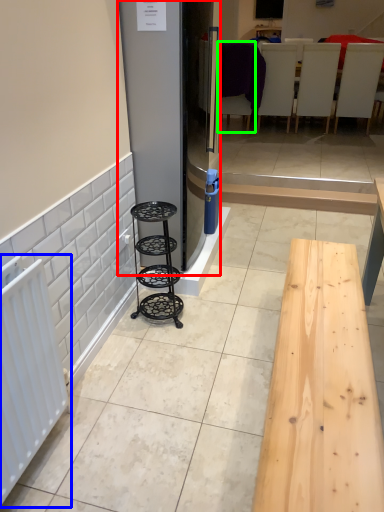
Question: Which object is positioned closest to fridge (highlighted by a red box)? Select from radiator (highlighted by a blue box) and furniture (highlighted by a green box).

Choices:
 (A) radiator
 (B) furniture

Answer: (A)